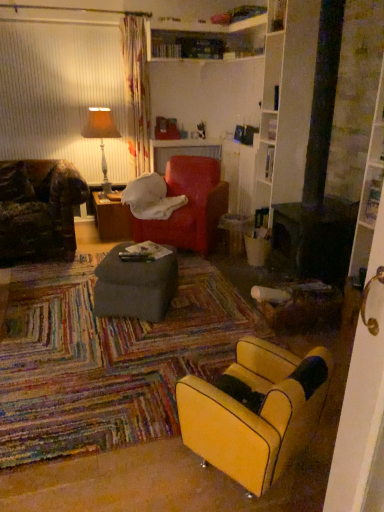
Where is `vacant space to the left of yellow leather chair at lower right`? vacant space to the left of yellow leather chair at lower right is located at coordinates (151, 476).